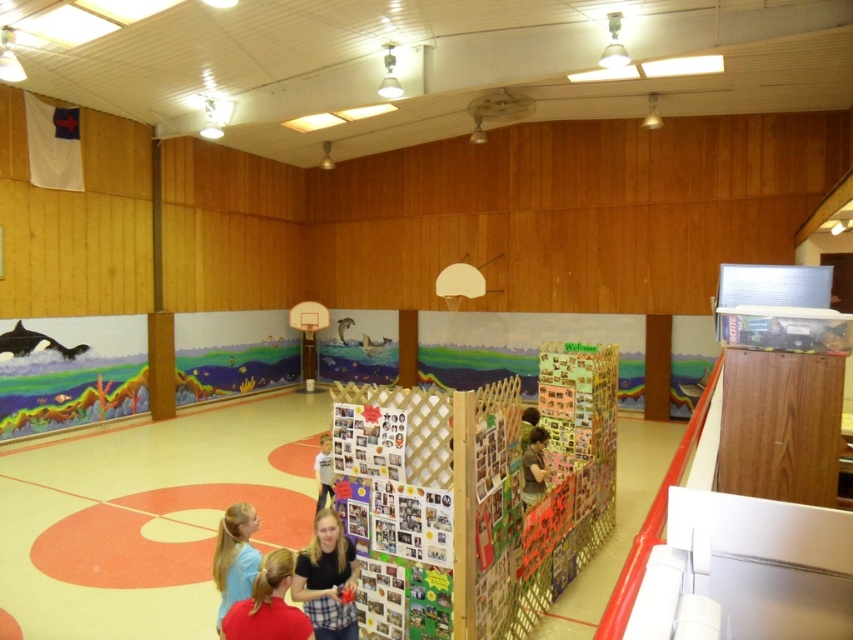
Image resolution: width=853 pixels, height=640 pixels. Describe the element at coordinates (328, 579) in the screenshot. I see `plaid shirt at center` at that location.

Where is `plaid shirt at center`? The width and height of the screenshot is (853, 640). plaid shirt at center is located at coordinates (328, 579).

Locate an element on the screen. This screenshot has height=640, width=853. plaid shirt at center is located at coordinates [328, 579].

Is matte brown shirt at center taller than light brown wooden frame at center?

No.

Does point (532, 456) lie behind point (323, 467)?

No, it is not.

At what (x,y) coordinates should I click in order to perform the action: click on matte brown shirt at center. Please return your answer as a coordinate pair (x, y). Looking at the image, I should click on (534, 465).

How far apart are plaid shirt at center and matte brown shirt at center?

They are 9.00 feet apart.

You are a GUI agent. You are given a task and a screenshot of the screen. Output one action in this format:
    pyautogui.click(x=<x>, y=<y>)
    Task: Click on the plaid shirt at center
    
    Given the screenshot: What is the action you would take?
    pyautogui.click(x=328, y=579)

At what (x,y) coordinates should I click in order to perform the action: click on plaid shirt at center. Please return your answer as a coordinate pair (x, y). Looking at the image, I should click on (328, 579).